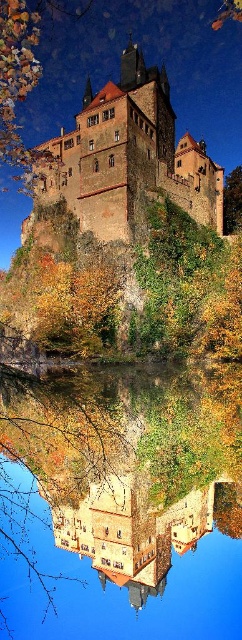
You are standing at the edge of the cliff overlooking the mirrored lake. You notice a point marked at coordinates (x=128, y=156). What does this point represent?

The point at coordinates (x=128, y=156) represents the brown stone castle at upper center.

You are a tourist standing at the base of the cliff, looking up at the brown stone castle at upper center. You want to take a photo that includes both the castle and its reflection in the water below. Given that the reflection is directly below the castle, how far will your camera need to focus to capture the castle itself?

The brown stone castle at upper center is 89.64 meters from viewer, so the camera needs to focus at 89.64 meters to capture the castle itself.